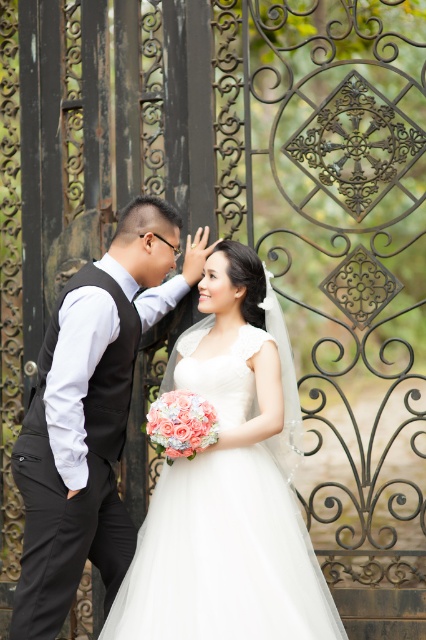
Is white satin dress at center smaller than black satin vest at left?

No, white satin dress at center is not smaller than black satin vest at left.

Looking at this image, which is above, white satin dress at center or black satin vest at left?

Positioned higher is black satin vest at left.

Between point (244, 317) and point (178, 221), which one is positioned behind?

The point (178, 221) is more distant.

Find the location of a particular element. This screenshot has height=640, width=426. white satin dress at center is located at coordinates pos(230,484).